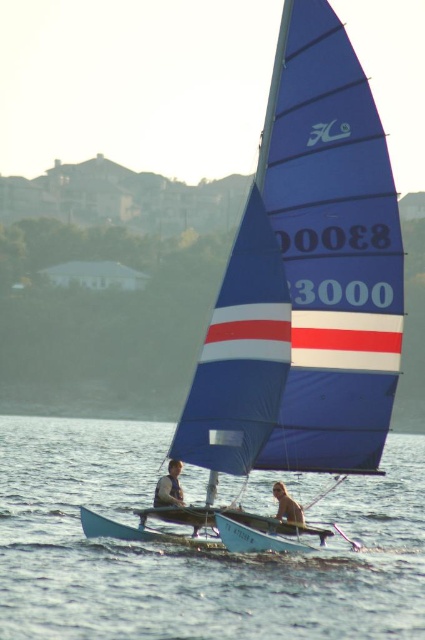
Question: Is blue fabric sailboat at center wider than brown fur dog at center?

Choices:
 (A) yes
 (B) no

Answer: (A)

Question: Which object appears farthest from the camera in this image?

Choices:
 (A) light brown leather jacket at lower left
 (B) blue fabric sailboat at center
 (C) blue water at center

Answer: (A)

Question: Can you confirm if blue fabric sailboat at center is smaller than brown fur dog at center?

Choices:
 (A) no
 (B) yes

Answer: (A)

Question: Based on their relative distances, which object is nearer to the brown fur dog at center?

Choices:
 (A) light brown leather jacket at lower left
 (B) blue fabric sailboat at center
 (C) blue water at center

Answer: (A)

Question: Which object is positioned closest to the blue fabric sailboat at center?

Choices:
 (A) blue water at center
 (B) light brown leather jacket at lower left

Answer: (B)

Question: Does blue water at center lie in front of brown fur dog at center?

Choices:
 (A) no
 (B) yes

Answer: (B)